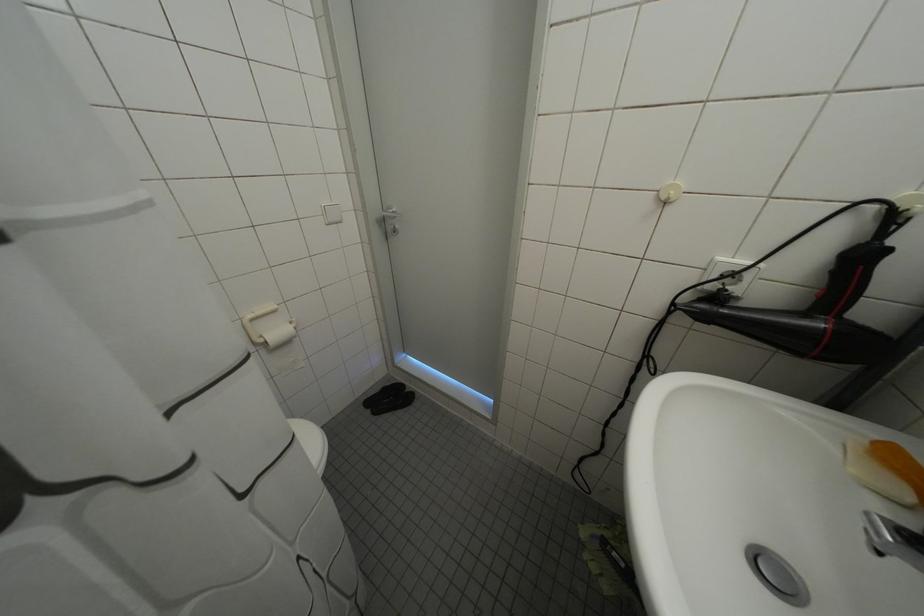
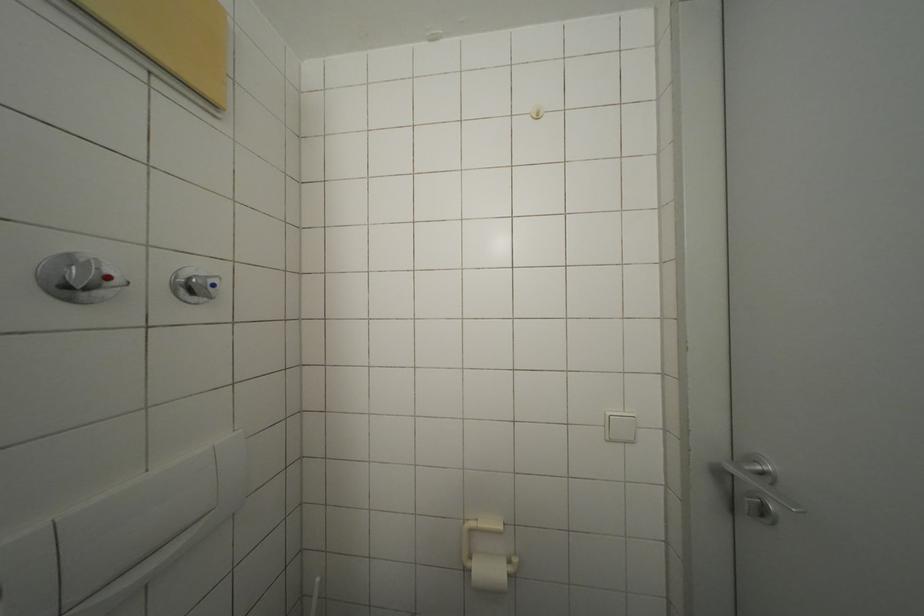
Question: Based on the continuous images, in which direction is the camera rotating? Reply with the corresponding letter.

Choices:
 (A) Left
 (B) Right
 (C) Up
 (D) Down

Answer: (A)